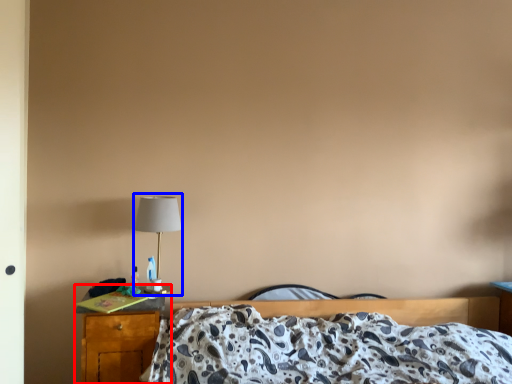
Question: Which point is closer to the camera, nightstand (highlighted by a red box) or table lamp (highlighted by a blue box)?

Choices:
 (A) nightstand
 (B) table lamp

Answer: (A)